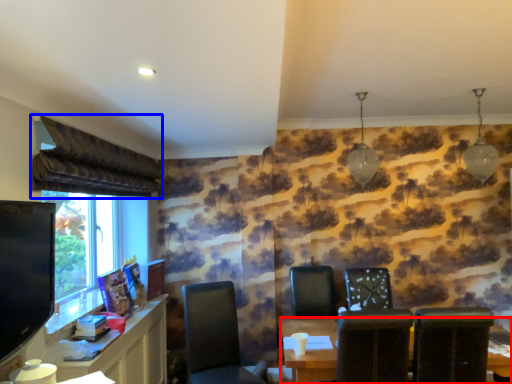
Question: Which object appears farthest to the camera in this image, table (highlighted by a red box) or curtain (highlighted by a blue box)?

Choices:
 (A) table
 (B) curtain

Answer: (A)